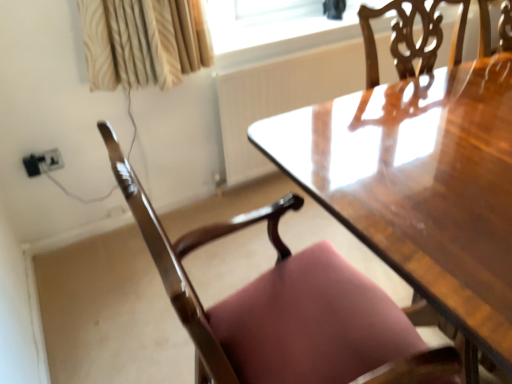
Question: Is black plastic outlet at lower left oriented away from glossy wood chair at lower left?

Choices:
 (A) no
 (B) yes

Answer: (A)

Question: From the image's perspective, is black plastic outlet at lower left located above glossy wood chair at lower left?

Choices:
 (A) no
 (B) yes

Answer: (B)

Question: Is black plastic outlet at lower left not within glossy wood chair at lower left?

Choices:
 (A) no
 (B) yes

Answer: (B)

Question: From the image's perspective, is black plastic outlet at lower left under glossy wood chair at lower left?

Choices:
 (A) no
 (B) yes

Answer: (A)

Question: Is black plastic outlet at lower left surrounding glossy wood chair at lower left?

Choices:
 (A) no
 (B) yes

Answer: (A)

Question: From a real-world perspective, is black plastic outlet at lower left positioned above or below glossy wood chair at lower left?

Choices:
 (A) below
 (B) above

Answer: (A)

Question: From the image's perspective, is black plastic outlet at lower left located above or below glossy wood chair at lower left?

Choices:
 (A) below
 (B) above

Answer: (B)

Question: Is black plastic outlet at lower left in front of or behind glossy wood chair at lower left in the image?

Choices:
 (A) front
 (B) behind

Answer: (B)

Question: Is black plastic outlet at lower left to the left or to the right of glossy wood chair at lower left in the image?

Choices:
 (A) right
 (B) left

Answer: (B)

Question: Is black plastic outlet at lower left bigger or smaller than transparent glass window screen at upper center?

Choices:
 (A) big
 (B) small

Answer: (B)

Question: Considering the positions of black plastic outlet at lower left and transparent glass window screen at upper center in the image, is black plastic outlet at lower left taller or shorter than transparent glass window screen at upper center?

Choices:
 (A) tall
 (B) short

Answer: (A)

Question: Is black plastic outlet at lower left spatially inside transparent glass window screen at upper center, or outside of it?

Choices:
 (A) outside
 (B) inside

Answer: (A)

Question: From the image's perspective, relative to transparent glass window screen at upper center, is black plastic outlet at lower left above or below?

Choices:
 (A) above
 (B) below

Answer: (B)

Question: From the image's perspective, is glossy wood chair at lower left located above or below black plastic outlet at lower left?

Choices:
 (A) above
 (B) below

Answer: (B)

Question: Looking at the image, does glossy wood chair at lower left seem bigger or smaller compared to black plastic outlet at lower left?

Choices:
 (A) small
 (B) big

Answer: (B)